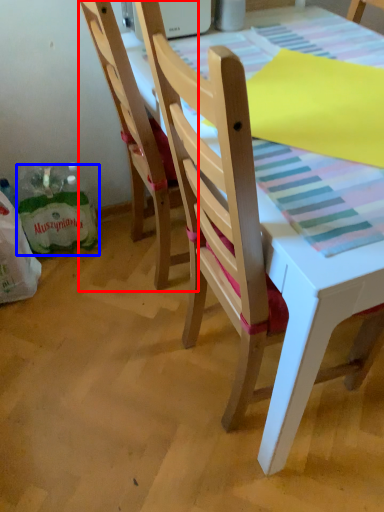
Question: Which of the following is the farthest to the observer, chair (highlighted by a red box) or shopping bag (highlighted by a blue box)?

Choices:
 (A) chair
 (B) shopping bag

Answer: (B)